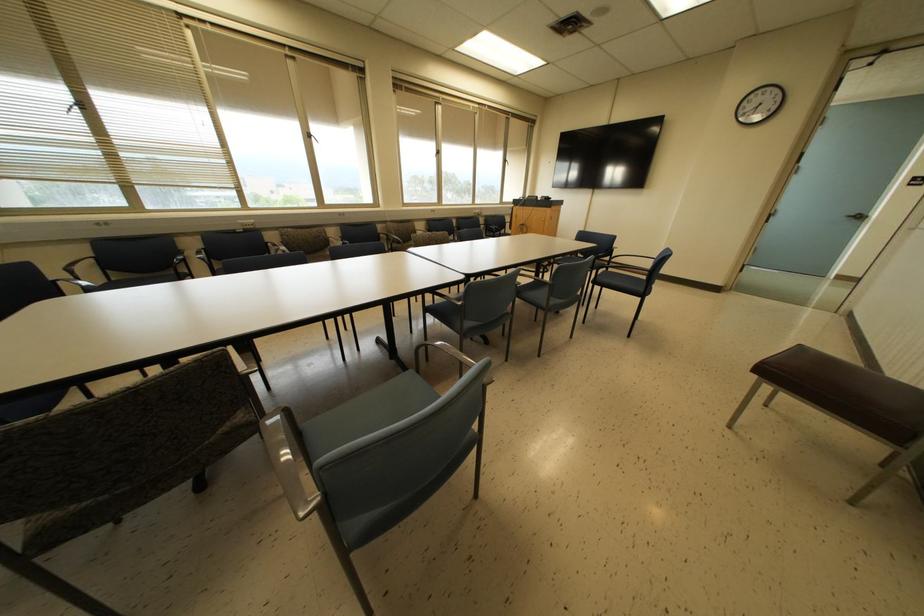
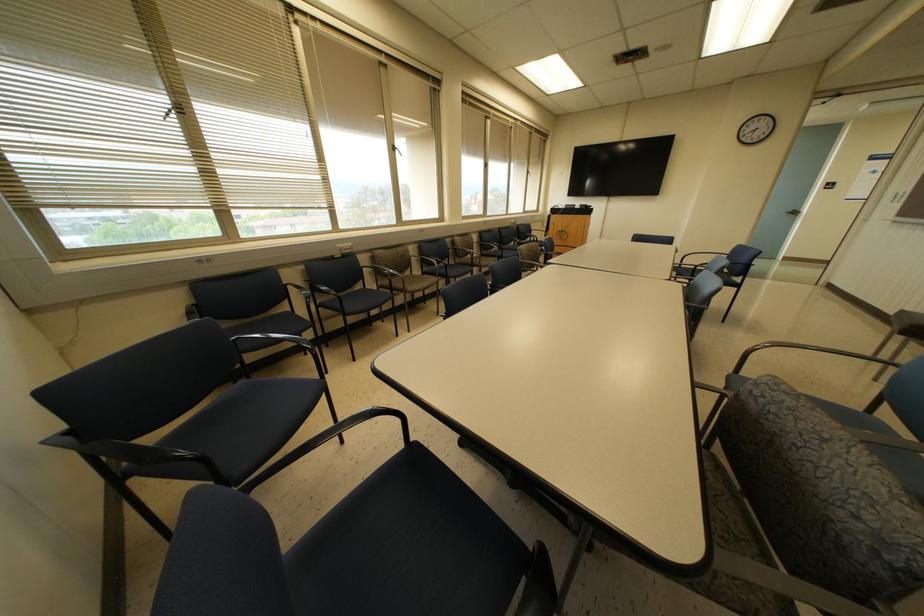
Question: What movement of the cameraman would produce the second image?

Choices:
 (A) Left
 (B) Right
 (C) Forward
 (D) Backward

Answer: (A)